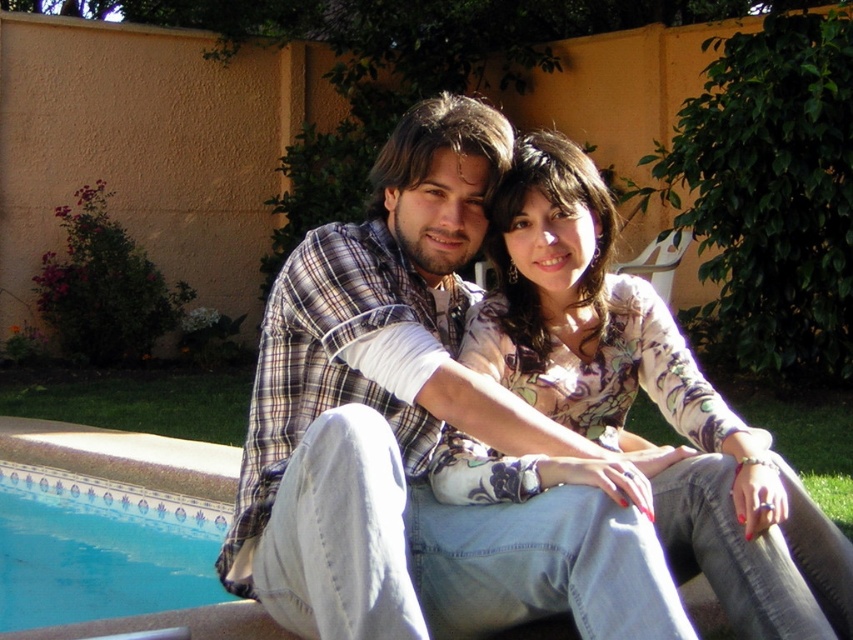
Question: From the image, what is the correct spatial relationship of floral print blouse at center in relation to blue tile pool at lower left?

Choices:
 (A) right
 (B) left

Answer: (A)

Question: Is plaid shirt at center to the left of blue tile pool at lower left from the viewer's perspective?

Choices:
 (A) yes
 (B) no

Answer: (B)

Question: Among these objects, which one is farthest from the camera?

Choices:
 (A) blue tile pool at lower left
 (B) floral print blouse at center
 (C) plaid shirt at center

Answer: (A)

Question: Considering the relative positions of floral print blouse at center and blue tile pool at lower left in the image provided, where is floral print blouse at center located with respect to blue tile pool at lower left?

Choices:
 (A) right
 (B) left

Answer: (A)

Question: Which point is closer to the camera?

Choices:
 (A) blue tile pool at lower left
 (B) plaid shirt at center
 (C) floral print blouse at center

Answer: (B)

Question: Which object is positioned closest to the blue tile pool at lower left?

Choices:
 (A) plaid shirt at center
 (B) floral print blouse at center

Answer: (A)